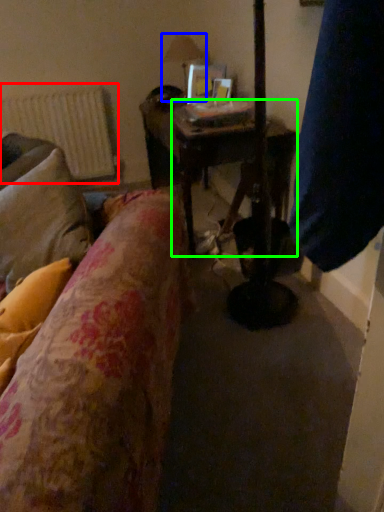
Question: Based on their relative distances, which object is nearer to radiator (highlighted by a red box)? Choose from table lamp (highlighted by a blue box) and table (highlighted by a green box).

Choices:
 (A) table lamp
 (B) table

Answer: (A)